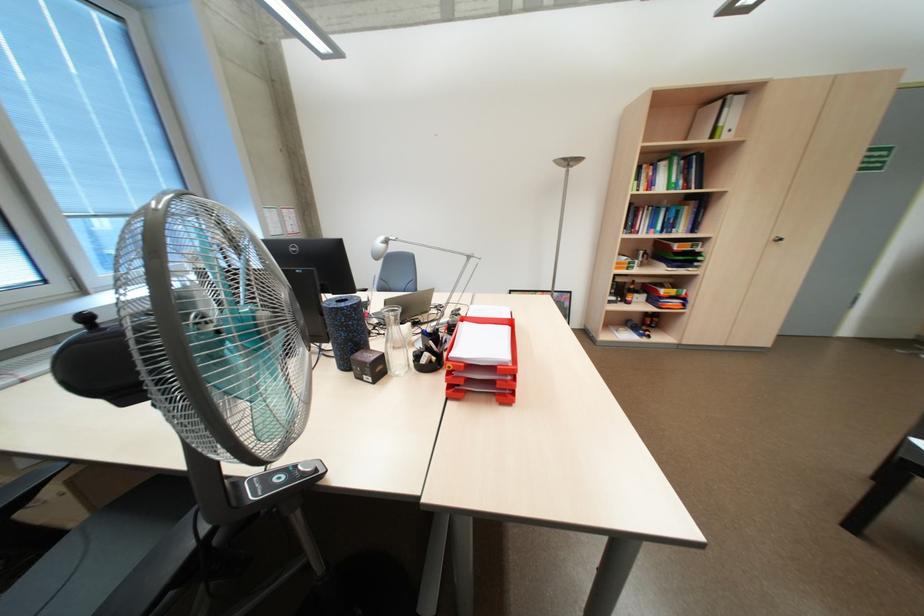
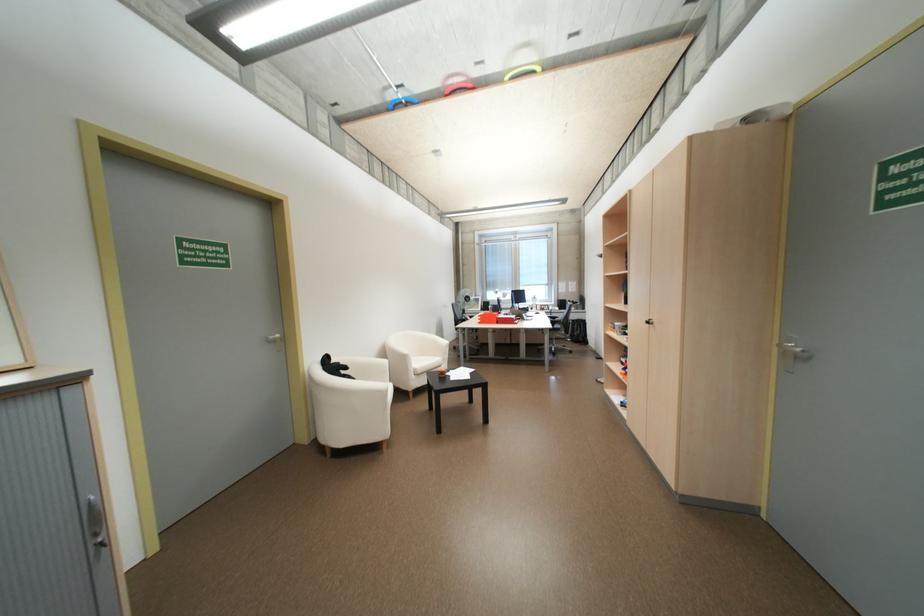
Question: I am providing you with two images of the same scene from different viewpoints. Which of the following objects are not visible in image2?

Choices:
 (A) silver door handle
 (B) white chair sitting surface
 (C) green picture frame
 (D) bottle on shelf

Answer: (D)